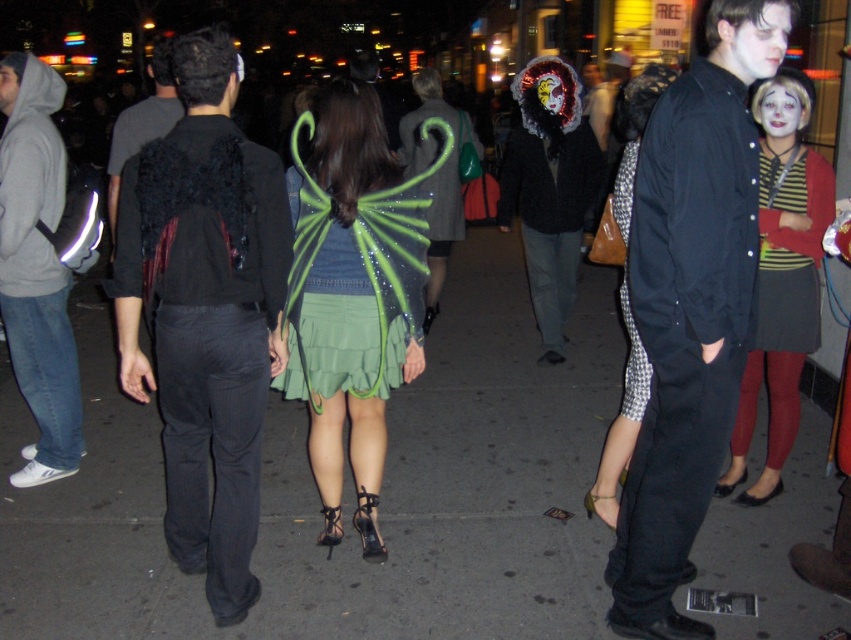
From the picture: You are a photographer trying to capture a candid shot of the printed fabric skirt at center without including the gray hoodie at left in the frame. Based on their positions, is this possible?

The printed fabric skirt at center is behind the gray hoodie at left, so it would be blocked from view. Therefore, you cannot capture the printed fabric skirt at center without the gray hoodie at left in the frame.